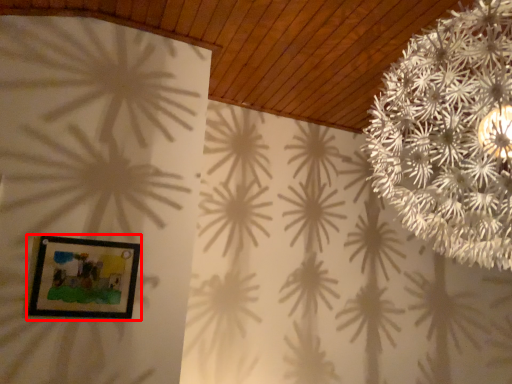
Question: In this image, where is picture frame (annotated by the red box) located relative to flower?

Choices:
 (A) left
 (B) right

Answer: (A)